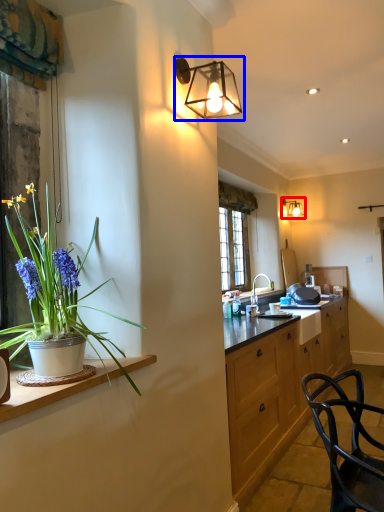
Question: Which object appears farthest to the camera in this image, lamp (highlighted by a red box) or lamp (highlighted by a blue box)?

Choices:
 (A) lamp
 (B) lamp

Answer: (A)